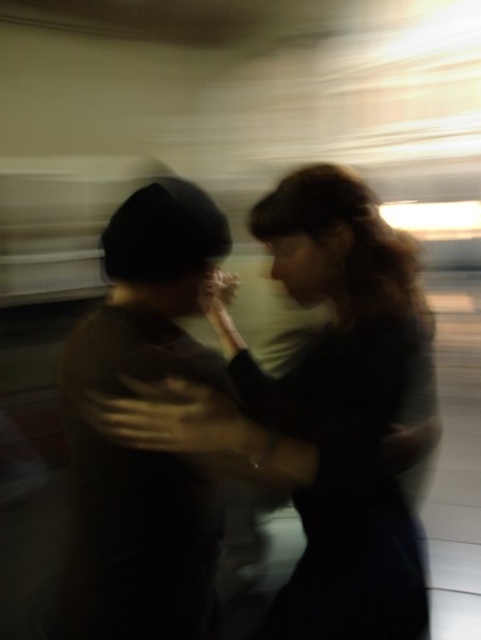
Which is more to the left, dark brown fabric at center or dark brown knit hat at left?

dark brown knit hat at left

Image resolution: width=481 pixels, height=640 pixels. What do you see at coordinates (321, 410) in the screenshot? I see `dark brown fabric at center` at bounding box center [321, 410].

Locate an element on the screen. This screenshot has width=481, height=640. dark brown fabric at center is located at coordinates (321, 410).